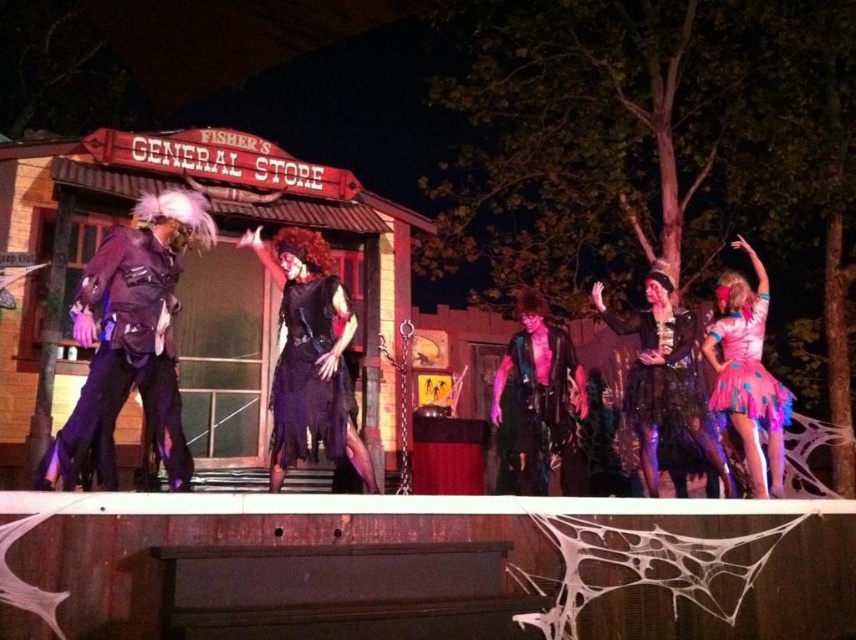
You are standing in front of the Fisher General Store and need to determine the distance between two points marked in the image. The first point is at coordinates point (298, 282) and the second is at point (727, 332). Given that the first point is closer to you, which point would require you to walk further to reach?

Point (727, 332) is further away from the viewer, so you would need to walk further to reach it.

You are a stagehand who needs to move a 3.5 meter long ladder from the black velvet dress at center to the shiny pink tulle skirt at right. Is there enough space to move the ladder without bending it?

The distance between the black velvet dress at center and the shiny pink tulle skirt at right is 2.94 meters. Since the ladder is 3.5 meters long, it is longer than the available space. Therefore, you cannot move the ladder straight without bending it.